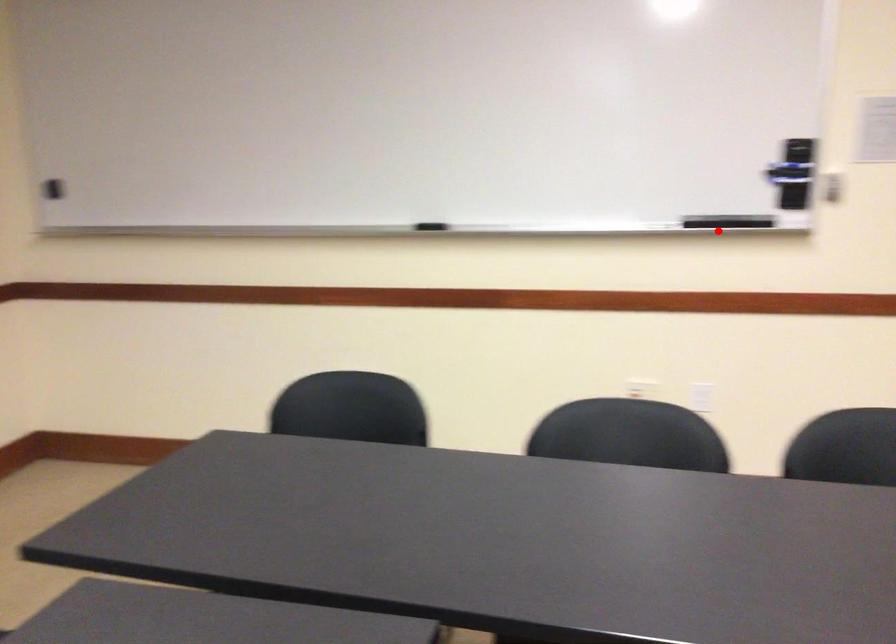
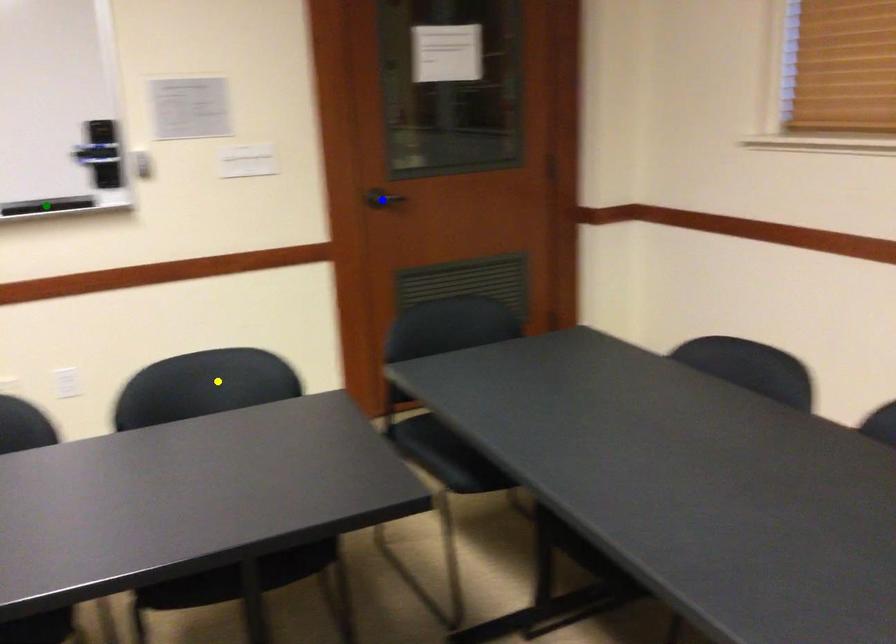
Question: I am providing you with two images of the same scene from different viewpoints. A red point is marked on the first image. You are given multiple points on the second image. Which point in image 2 represents the same 3d spot as the red point in image 1?

Choices:
 (A) green point
 (B) blue point
 (C) yellow point

Answer: (A)